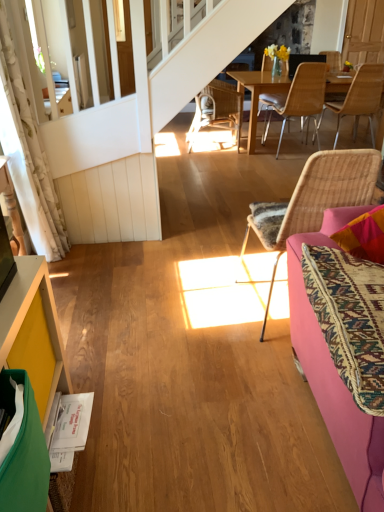
Question: Considering the relative positions of pink fabric couch at right and white floral fabric curtain at left in the image provided, is pink fabric couch at right in front of white floral fabric curtain at left?

Choices:
 (A) no
 (B) yes

Answer: (B)

Question: Is pink fabric couch at right at the left side of white floral fabric curtain at left?

Choices:
 (A) yes
 (B) no

Answer: (B)

Question: Is pink fabric couch at right wider than white floral fabric curtain at left?

Choices:
 (A) yes
 (B) no

Answer: (A)

Question: Is pink fabric couch at right not within white floral fabric curtain at left?

Choices:
 (A) no
 (B) yes

Answer: (B)

Question: Is pink fabric couch at right touching white floral fabric curtain at left?

Choices:
 (A) yes
 (B) no

Answer: (B)

Question: Does pink fabric couch at right have a lesser height compared to white floral fabric curtain at left?

Choices:
 (A) no
 (B) yes

Answer: (B)

Question: Is white floral fabric curtain at left not inside woven rattan chair at center, the 1th chair viewed from the left?

Choices:
 (A) no
 (B) yes

Answer: (B)

Question: Is white floral fabric curtain at left wider than woven rattan chair at center, the 1th chair when ordered from back to front?

Choices:
 (A) no
 (B) yes

Answer: (A)

Question: From a real-world perspective, is white floral fabric curtain at left located higher than woven rattan chair at center, the 1th chair viewed from the left?

Choices:
 (A) yes
 (B) no

Answer: (A)

Question: Is white floral fabric curtain at left at the left side of woven rattan chair at center, the fourth chair when ordered from front to back?

Choices:
 (A) no
 (B) yes

Answer: (B)

Question: Can you confirm if white floral fabric curtain at left is taller than woven rattan chair at center, the 1th chair viewed from the left?

Choices:
 (A) no
 (B) yes

Answer: (B)

Question: Can you confirm if white floral fabric curtain at left is positioned to the right of woven rattan chair at center, acting as the fourth chair starting from the right?

Choices:
 (A) no
 (B) yes

Answer: (A)

Question: From the image's perspective, does yellow painted wood cabinet at lower left appear higher than pink fabric couch at right?

Choices:
 (A) no
 (B) yes

Answer: (A)